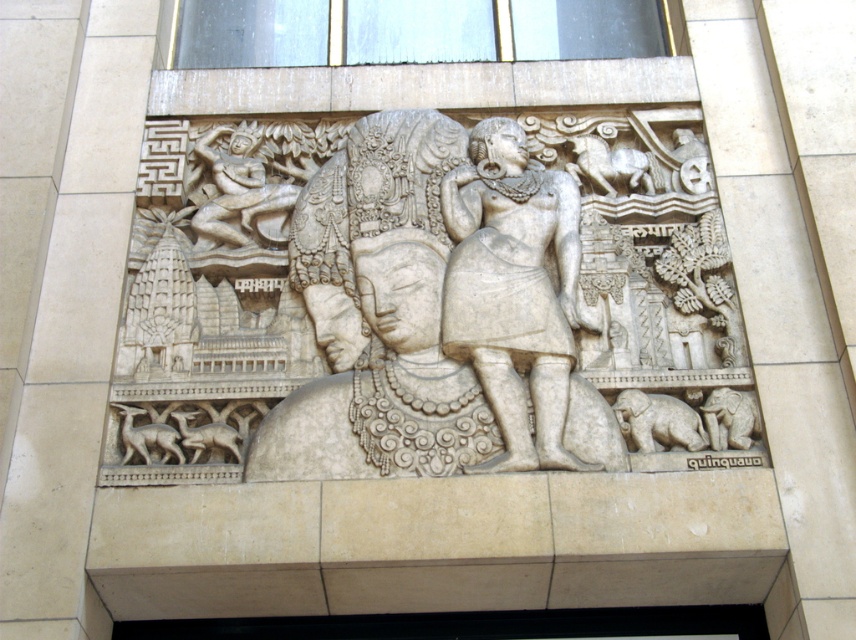
Based on the scene description, where is the white stone carving at center located in the relief?

The white stone carving at center is located at point coordinates of (432, 307).

Based on the scene described, which object is taller between the white stone carving at center and the white stone figure at center?

The white stone carving at center is taller than the white stone figure at center according to the description.